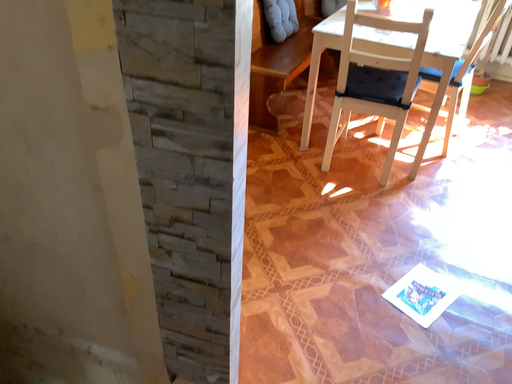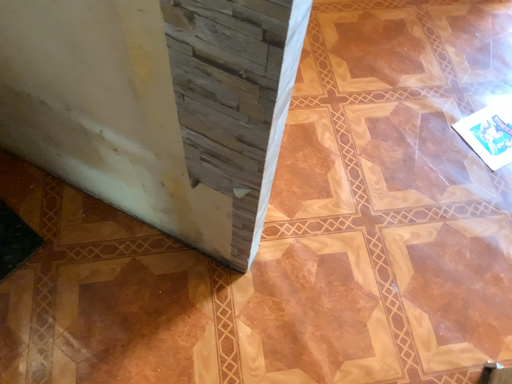
Question: Which way did the camera rotate in the video?

Choices:
 (A) rotated left
 (B) rotated right

Answer: (A)